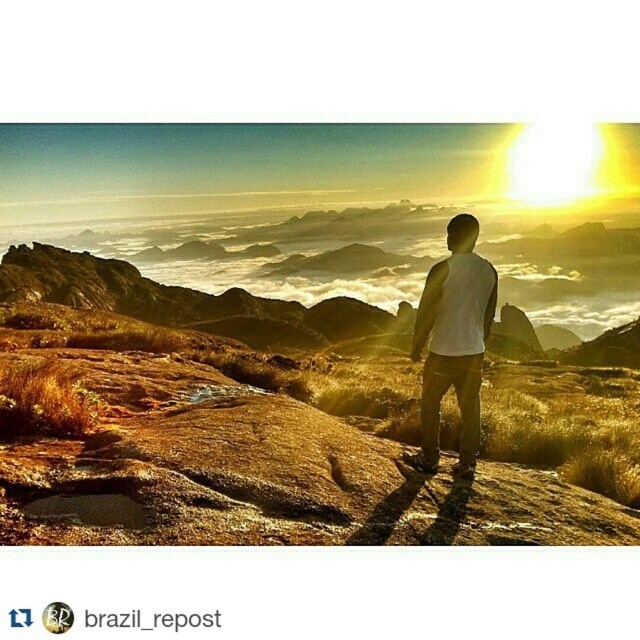
You are a hiker standing at the base of the brown rocky mountain at center and looking towards the white matte shirt at center. Which object is higher in elevation?

The brown rocky mountain at center is taller than the white matte shirt at center, so the brown rocky mountain at center is higher in elevation.

You are standing at the coordinates point 0.5, 0.5 in the image. Which direction should you move to reach the brown rocky mountain at center?

The brown rocky mountain at center is located at point [280,422]. Since you are at point [320,320], you should move northeast to reach it.

You are standing at the point labeled as point (280, 422) in the image. What is the name of the object you are standing on?

The point labeled as point (280, 422) indicates a brown rocky mountain at center.